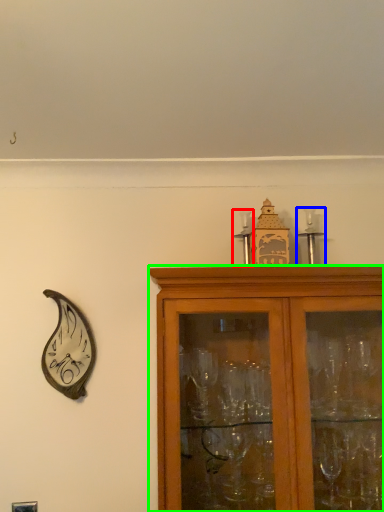
Question: Which object is the closest to the candle holder (highlighted by a red box)? Choose among these: candle holder (highlighted by a blue box) or cabinetry (highlighted by a green box).

Choices:
 (A) candle holder
 (B) cabinetry

Answer: (A)